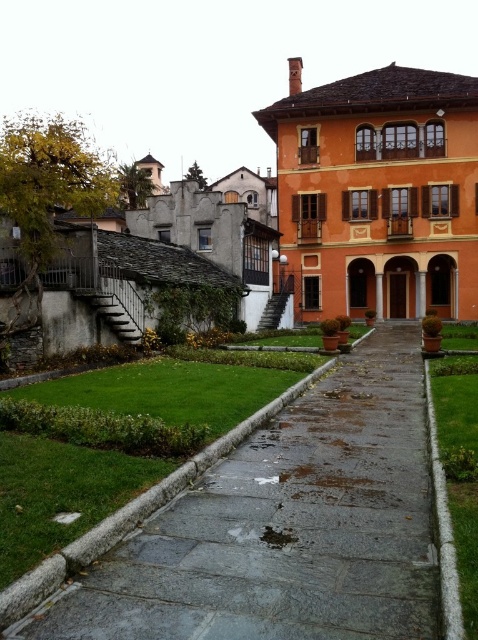
Question: Which point is closer to the camera taking this photo?

Choices:
 (A) (466, 472)
 (B) (117, 609)

Answer: (B)

Question: Where is gray concrete path at center located in relation to green grass at center in the image?

Choices:
 (A) right
 (B) left

Answer: (B)

Question: Does gray concrete path at center appear over green grass at center?

Choices:
 (A) yes
 (B) no

Answer: (B)

Question: Can you confirm if gray concrete path at center is wider than green grass at center?

Choices:
 (A) no
 (B) yes

Answer: (B)

Question: Which point is closer to the camera?

Choices:
 (A) green grass at center
 (B) gray concrete path at center

Answer: (A)

Question: Which object is closer to the camera taking this photo?

Choices:
 (A) green grass at center
 (B) gray concrete path at center

Answer: (A)